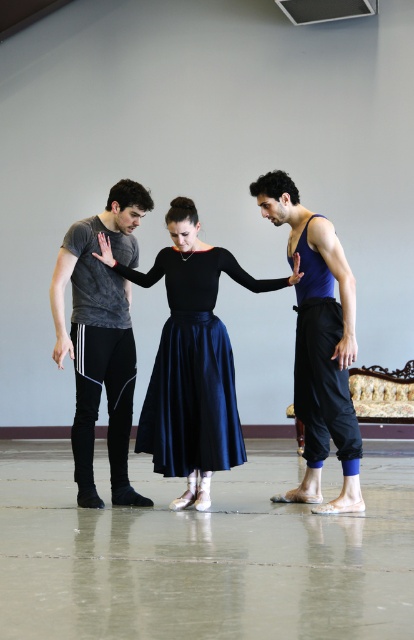
Question: Based on their relative distances, which object is nearer to the dark gray matte t-shirt at left?

Choices:
 (A) blue fabric tank top at center
 (B) satin skirt at center

Answer: (B)

Question: Does satin skirt at center have a smaller size compared to blue fabric tank top at center?

Choices:
 (A) no
 (B) yes

Answer: (B)

Question: Does dark gray matte t-shirt at left come in front of blue fabric tank top at center?

Choices:
 (A) no
 (B) yes

Answer: (A)

Question: Which object appears farthest from the camera in this image?

Choices:
 (A) satin skirt at center
 (B) blue fabric tank top at center

Answer: (A)

Question: Which is farther from the dark gray matte t-shirt at left?

Choices:
 (A) satin skirt at center
 (B) blue fabric tank top at center

Answer: (B)

Question: Observing the image, what is the correct spatial positioning of dark gray matte t-shirt at left in reference to blue fabric tank top at center?

Choices:
 (A) right
 (B) left

Answer: (B)